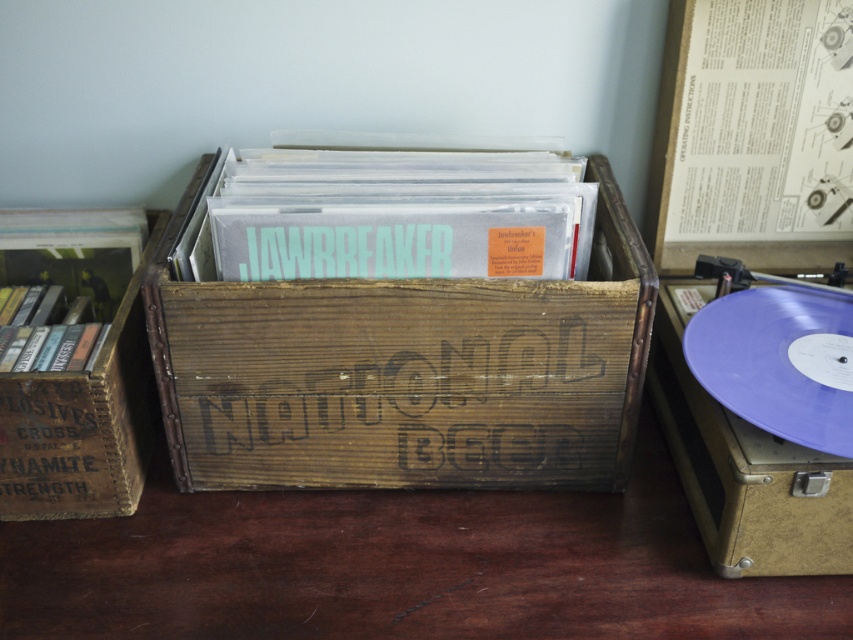
You are organizing a music collection and need to place a new vinyl record. The wooden crate at center and brown wooden crate at left are both available. Which crate has a larger width for potentially holding wider records?

The wooden crate at center has a larger width than the brown wooden crate at left, making it suitable for wider records.